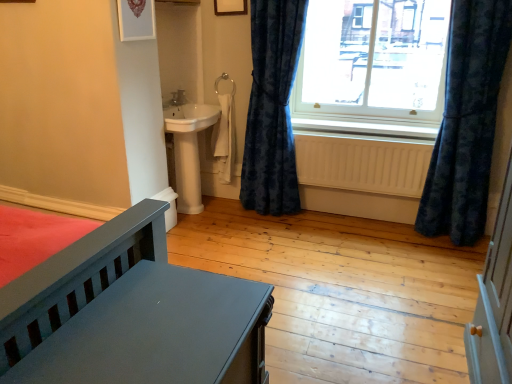
Question: Considering the relative sizes of matte gray bed at lower left and velvet blue curtain at right, positioned as the first curtain in left-to-right order, in the image provided, is matte gray bed at lower left taller than velvet blue curtain at right, positioned as the first curtain in left-to-right order,?

Choices:
 (A) no
 (B) yes

Answer: (A)

Question: Considering the relative positions of matte gray bed at lower left and velvet blue curtain at right, which ranks as the second curtain in right-to-left order, in the image provided, is matte gray bed at lower left to the left of velvet blue curtain at right, which ranks as the second curtain in right-to-left order, from the viewer's perspective?

Choices:
 (A) yes
 (B) no

Answer: (A)

Question: Would you say velvet blue curtain at right, positioned as the first curtain in left-to-right order, is part of matte gray bed at lower left's contents?

Choices:
 (A) yes
 (B) no

Answer: (B)

Question: Is matte gray bed at lower left closer to the viewer compared to velvet blue curtain at right, which ranks as the second curtain in right-to-left order?

Choices:
 (A) yes
 (B) no

Answer: (A)

Question: Does matte gray bed at lower left have a greater width compared to velvet blue curtain at right, which ranks as the second curtain in right-to-left order?

Choices:
 (A) yes
 (B) no

Answer: (A)

Question: Is the depth of matte gray bed at lower left greater than that of velvet blue curtain at right, positioned as the first curtain in left-to-right order?

Choices:
 (A) no
 (B) yes

Answer: (A)

Question: Does beige wooden radiator at lower center have a smaller size compared to velvet dark blue curtain at right, which appears as the first curtain when viewed from the right?

Choices:
 (A) yes
 (B) no

Answer: (A)

Question: Is velvet dark blue curtain at right, acting as the 2th curtain starting from the left, at the back of beige wooden radiator at lower center?

Choices:
 (A) no
 (B) yes

Answer: (A)

Question: Is beige wooden radiator at lower center to the right of velvet dark blue curtain at right, acting as the 2th curtain starting from the left, from the viewer's perspective?

Choices:
 (A) yes
 (B) no

Answer: (B)

Question: Does beige wooden radiator at lower center have a greater height compared to velvet dark blue curtain at right, which appears as the first curtain when viewed from the right?

Choices:
 (A) yes
 (B) no

Answer: (B)

Question: Is velvet dark blue curtain at right, acting as the 2th curtain starting from the left, completely or partially inside beige wooden radiator at lower center?

Choices:
 (A) no
 (B) yes

Answer: (A)

Question: Considering the relative sizes of beige wooden radiator at lower center and velvet dark blue curtain at right, which appears as the first curtain when viewed from the right, in the image provided, is beige wooden radiator at lower center thinner than velvet dark blue curtain at right, which appears as the first curtain when viewed from the right,?

Choices:
 (A) yes
 (B) no

Answer: (A)

Question: From a real-world perspective, does matte gray bed at lower left stand above transparent glass window at upper right?

Choices:
 (A) no
 (B) yes

Answer: (A)